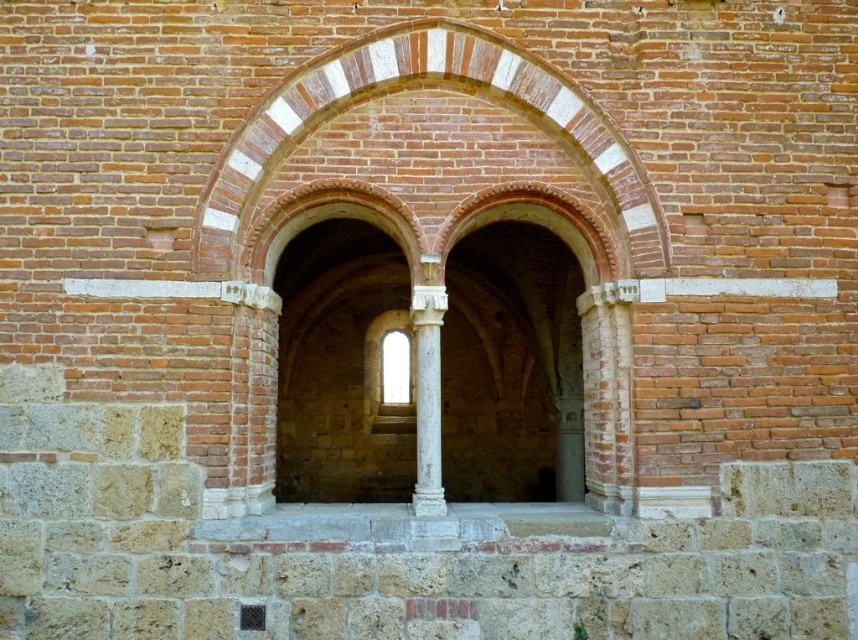
Question: Which object appears farthest from the camera in this image?

Choices:
 (A) clear glass window at center
 (B) brick archway at center
 (C) white marble column at center

Answer: (A)

Question: Among these objects, which one is farthest from the camera?

Choices:
 (A) white marble column at center
 (B) clear glass window at center
 (C) brick archway at center

Answer: (B)

Question: Is brick archway at center to the left of clear glass window at center from the viewer's perspective?

Choices:
 (A) no
 (B) yes

Answer: (A)

Question: Where is white marble column at center located in relation to clear glass window at center in the image?

Choices:
 (A) below
 (B) above

Answer: (A)

Question: Does brick archway at center have a greater width compared to clear glass window at center?

Choices:
 (A) yes
 (B) no

Answer: (A)

Question: Among these objects, which one is nearest to the camera?

Choices:
 (A) clear glass window at center
 (B) white marble column at center

Answer: (B)